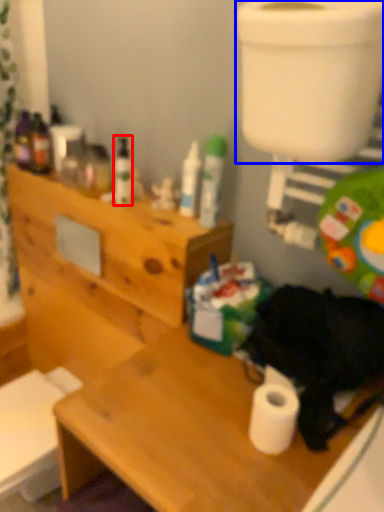
Question: Which object is further to the camera taking this photo, toiletry (highlighted by a red box) or toilet bowl (highlighted by a blue box)?

Choices:
 (A) toiletry
 (B) toilet bowl

Answer: (A)